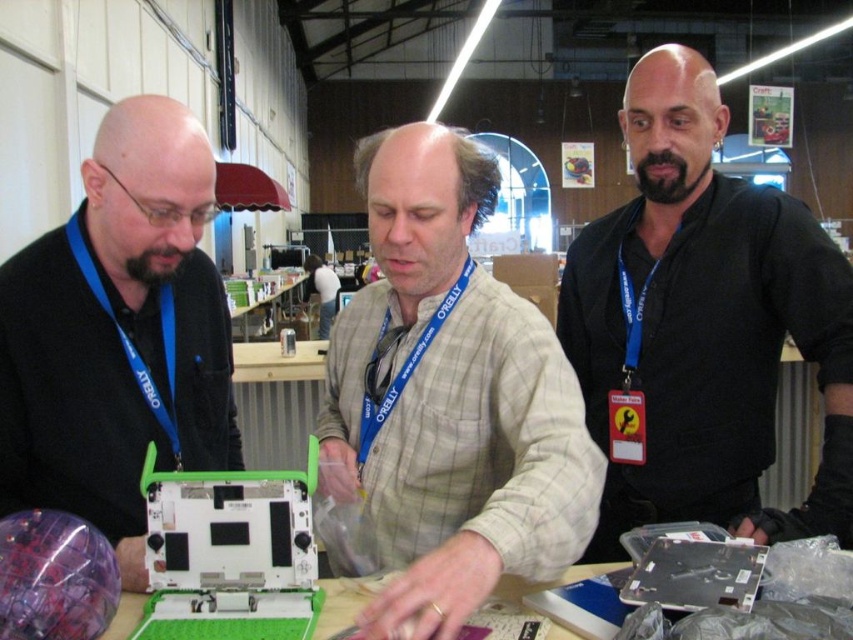
Question: Which point is closer to the camera?

Choices:
 (A) (161, 497)
 (B) (711, 605)
 (C) (221, 428)
 (D) (619, 506)

Answer: (B)

Question: Which point is farther to the camera?

Choices:
 (A) (554, 502)
 (B) (199, 589)

Answer: (B)

Question: Which object is farther from the camera taking this photo?

Choices:
 (A) black matte shirt at upper right
 (B) light brown plaid shirt at center
 (C) matte black laptop at center
 (D) matte black laptop at left

Answer: (A)

Question: Can you confirm if matte black laptop at left is positioned to the right of white plastic laptop at center?

Choices:
 (A) no
 (B) yes

Answer: (A)

Question: Where is light brown plaid shirt at center located in relation to white plastic laptop at center in the image?

Choices:
 (A) below
 (B) above

Answer: (B)

Question: Does light brown plaid shirt at center appear on the right side of white plastic laptop at center?

Choices:
 (A) no
 (B) yes

Answer: (B)